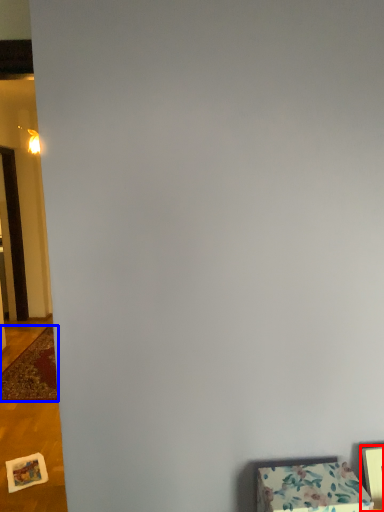
Question: Which object is closer to the camera taking this photo, picture frame (highlighted by a red box) or mat (highlighted by a blue box)?

Choices:
 (A) picture frame
 (B) mat

Answer: (A)